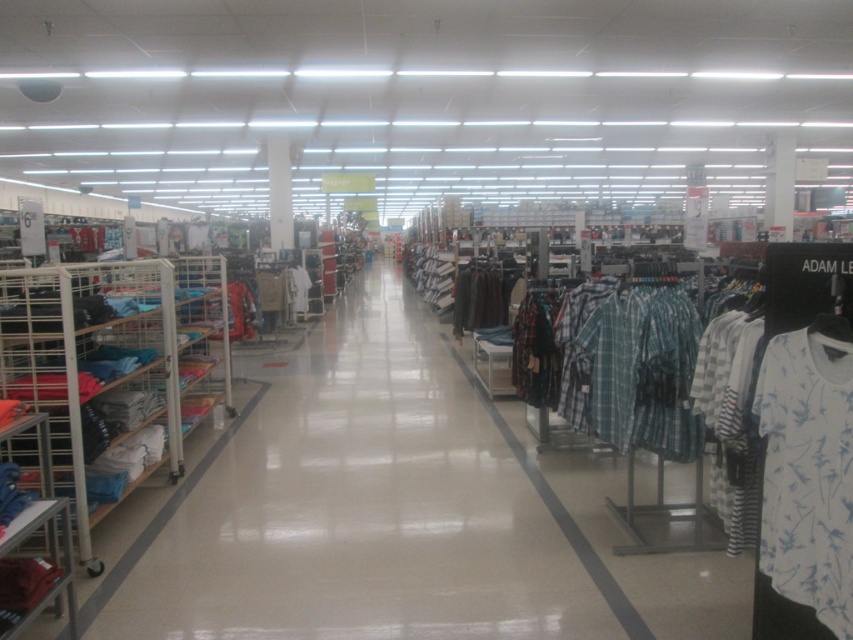
Is blue fabric shelf at left taller than white printed t-shirt at right?

Correct, blue fabric shelf at left is much taller as white printed t-shirt at right.

Does blue fabric shelf at left have a lesser height compared to white printed t-shirt at right?

In fact, blue fabric shelf at left may be taller than white printed t-shirt at right.

Who is more forward, (84, 538) or (836, 636)?

Point (836, 636) is more forward.

Where is `blue fabric shelf at left`? The width and height of the screenshot is (853, 640). blue fabric shelf at left is located at coordinates (115, 368).

Who is positioned more to the right, matte blue shirts at center or blue fabric shelf at left?

matte blue shirts at center

Locate an element on the screen. matte blue shirts at center is located at coordinates (363, 508).

Between matte blue shirts at center and white printed t-shirt at right, which one is positioned higher?

white printed t-shirt at right is above.

This screenshot has width=853, height=640. Find the location of `matte blue shirts at center`. matte blue shirts at center is located at coordinates (x=363, y=508).

Locate an element on the screen. matte blue shirts at center is located at coordinates pyautogui.click(x=363, y=508).